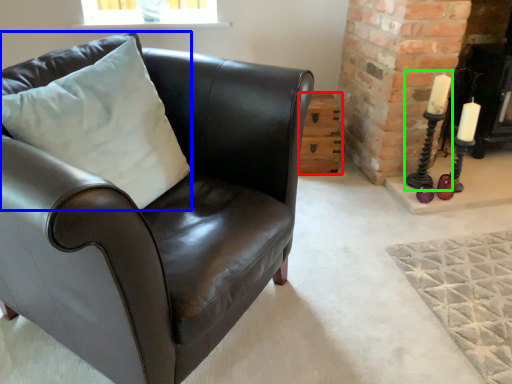
Question: Which is nearer to the table (highlighted by a red box)? pillow (highlighted by a blue box) or candle holder (highlighted by a green box).

Choices:
 (A) pillow
 (B) candle holder

Answer: (B)